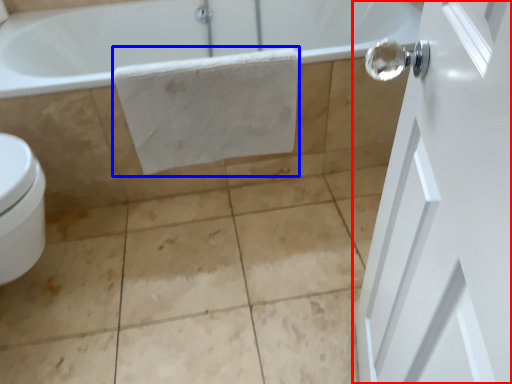
Question: Which point is further to the camera, door (highlighted by a red box) or bath towel (highlighted by a blue box)?

Choices:
 (A) door
 (B) bath towel

Answer: (B)